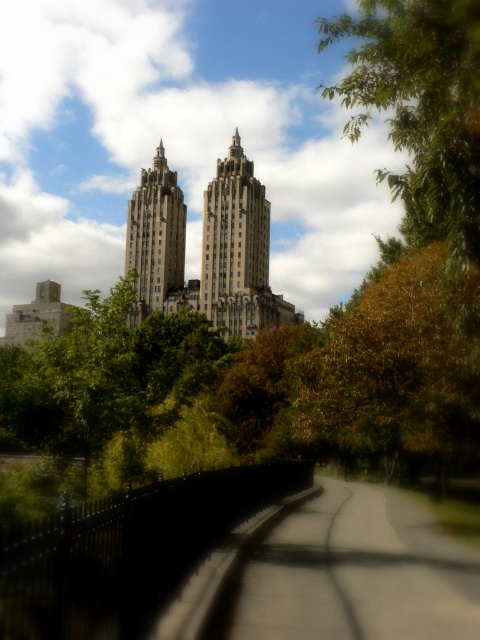
Is point (287, 509) less distant than point (278, 308)?

Yes.

Which of these two, smooth asphalt path at center or beige stone tower at center, stands shorter?

With less height is smooth asphalt path at center.

Between point (357, 579) and point (249, 198), which one is positioned in front?

Positioned in front is point (357, 579).

At what (x,y) coordinates should I click in order to perform the action: click on smooth asphalt path at center. Please return your answer as a coordinate pair (x, y). Looking at the image, I should click on (332, 573).

Find the location of `beige stone tower at center`. beige stone tower at center is located at coordinates (237, 250).

Who is shorter, brown leafy tree at center or beige stone tower at center?

With less height is brown leafy tree at center.

What do you see at coordinates (397, 371) in the screenshot? I see `brown leafy tree at center` at bounding box center [397, 371].

Where is `brown leafy tree at center`? The height and width of the screenshot is (640, 480). brown leafy tree at center is located at coordinates (397, 371).